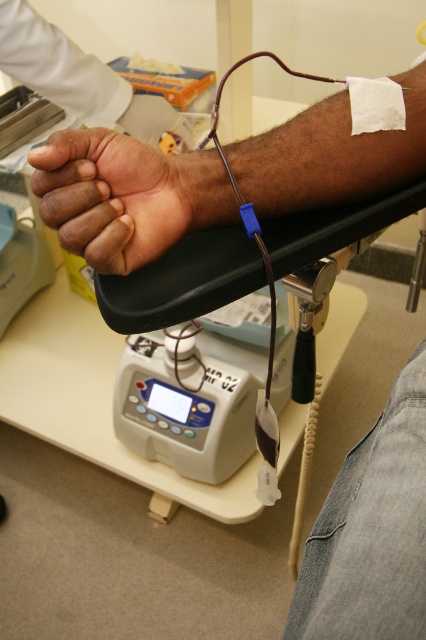
Between point (192, 228) and point (83, 138), which one is positioned in front?

Point (83, 138) is more forward.

Based on the photo, can you confirm if dark skin arm at upper center is positioned below dark skin palm at center?

Actually, dark skin arm at upper center is above dark skin palm at center.

Does point (325, 109) come in front of point (141, 173)?

No.

Find the location of `dark skin arm at upper center`. dark skin arm at upper center is located at coordinates (126, 195).